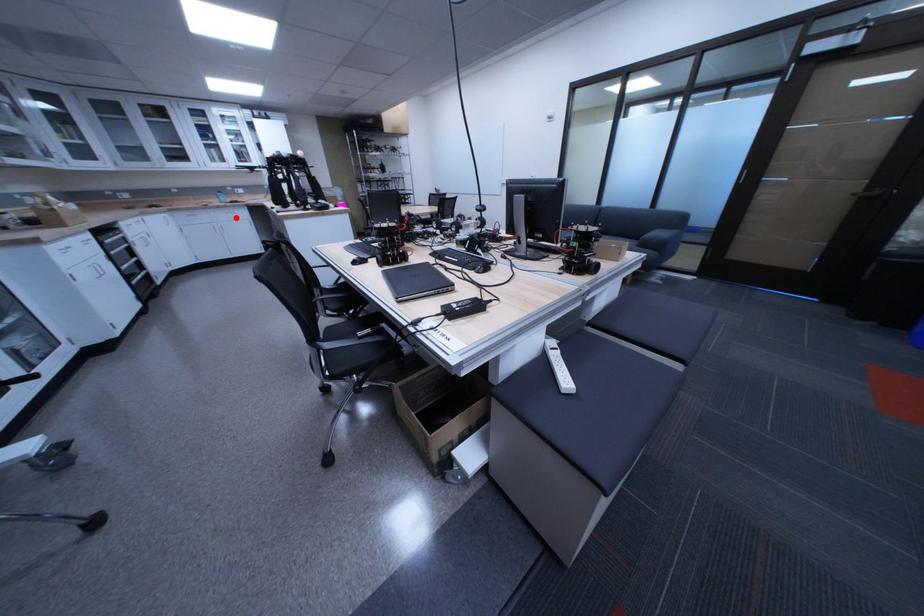
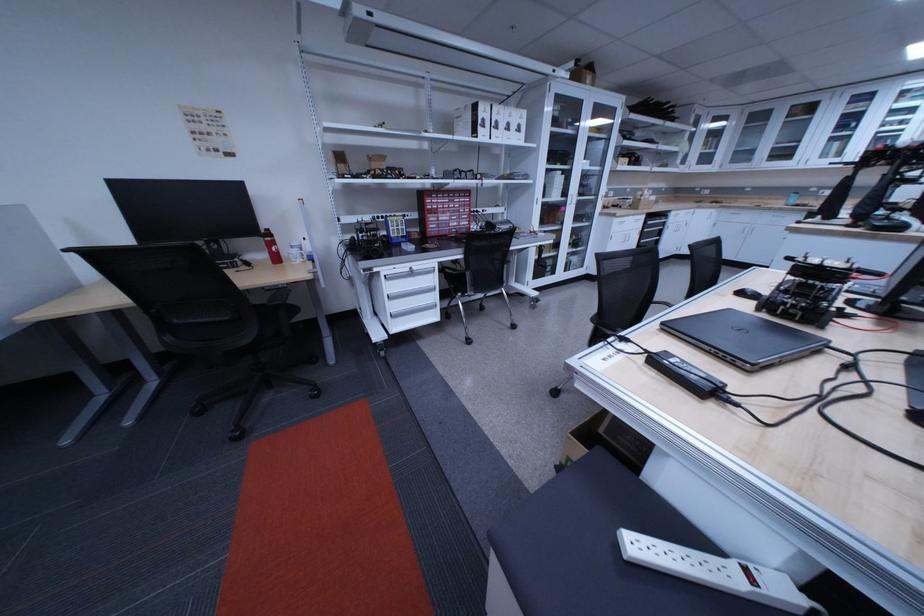
The point at the highlighted location is marked in the first image. Where is the corresponding point in the second image?

(779, 220)